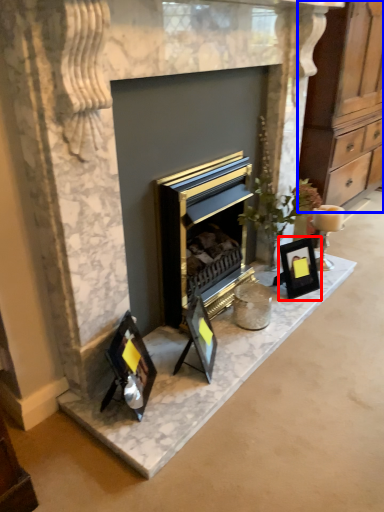
Question: Which object is closer to the camera taking this photo, picture frame (highlighted by a red box) or dresser (highlighted by a blue box)?

Choices:
 (A) picture frame
 (B) dresser

Answer: (A)